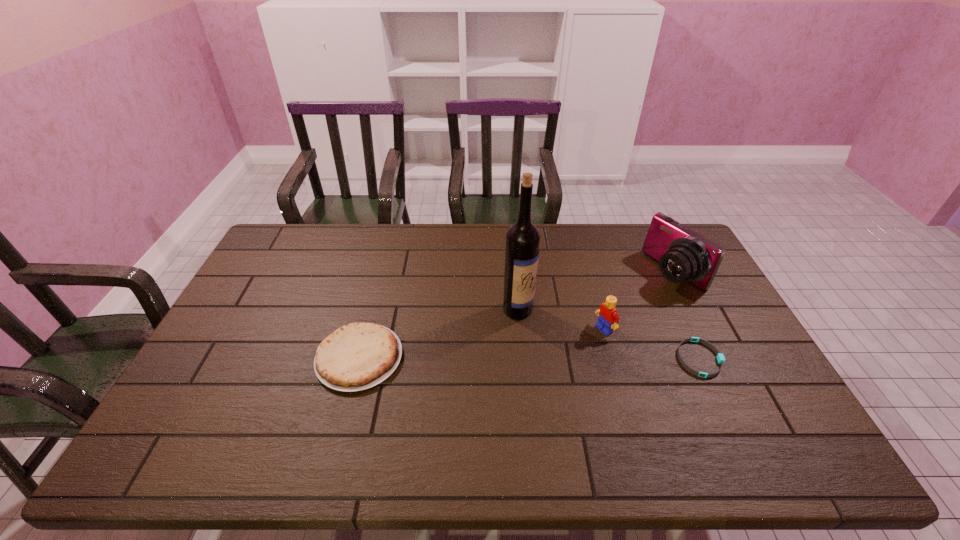
The width and height of the screenshot is (960, 540). Find the location of `vacant region that satisfies the following two spatial constraints: 1. on the back side of the third tallest object; 2. on the left side of the tortilla`. vacant region that satisfies the following two spatial constraints: 1. on the back side of the third tallest object; 2. on the left side of the tortilla is located at coordinates (367, 329).

Find the location of a particular element. This screenshot has height=540, width=960. vacant region that satisfies the following two spatial constraints: 1. on the front side of the leftmost object; 2. on the buckle of the wristband is located at coordinates (359, 359).

Identify the location of free region that satisfies the following two spatial constraints: 1. on the back side of the second shortest object; 2. on the right side of the wine bottle. This screenshot has width=960, height=540. (372, 309).

You are a GUI agent. You are given a task and a screenshot of the screen. Output one action in this format:
    pyautogui.click(x=<x>, y=<y>)
    Task: Click on the vacant region that satisfies the following two spatial constraints: 1. on the front side of the wristband; 2. on the buckle of the fourth tallest object
    Image resolution: width=960 pixels, height=540 pixels.
    Given the screenshot: What is the action you would take?
    (359, 359)

Identify the location of free region that satisfies the following two spatial constraints: 1. on the back side of the tortilla; 2. on the right side of the second tallest object. Image resolution: width=960 pixels, height=540 pixels. (381, 272).

Find the location of `vacant space that satisfies the following two spatial constraints: 1. on the back side of the camera; 2. on the right side of the wine bottle`. vacant space that satisfies the following two spatial constraints: 1. on the back side of the camera; 2. on the right side of the wine bottle is located at coordinates (515, 272).

Where is `vacant space that satisfies the following two spatial constraints: 1. on the back side of the third shortest object; 2. on the left side of the tortilla`? vacant space that satisfies the following two spatial constraints: 1. on the back side of the third shortest object; 2. on the left side of the tortilla is located at coordinates (367, 329).